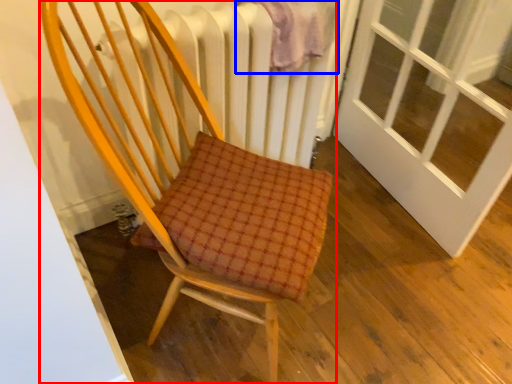
Question: Which object is further to the camera taking this photo, chair (highlighted by a red box) or blanket (highlighted by a blue box)?

Choices:
 (A) chair
 (B) blanket

Answer: (B)